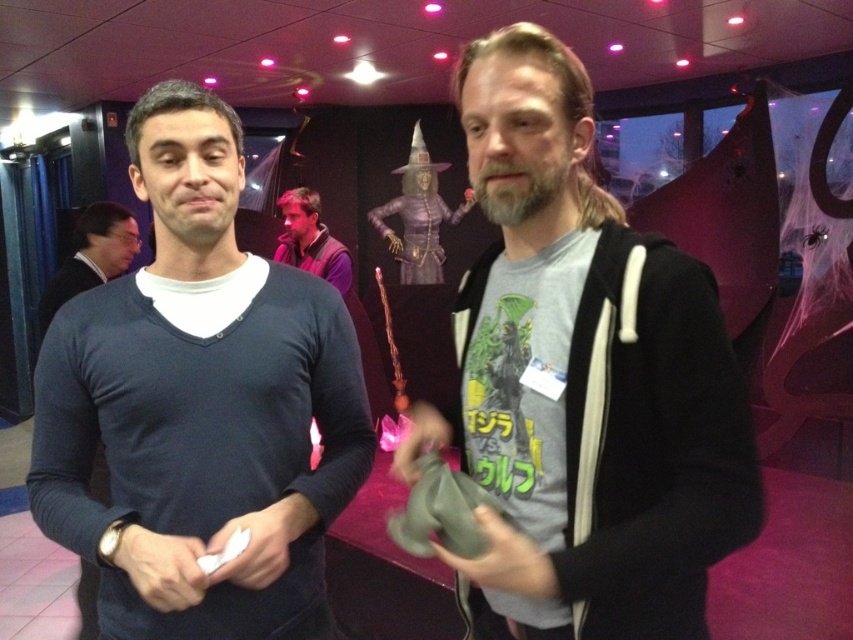
Is point (618, 435) positioned before point (294, 209)?

Yes.

Which is behind, point (689, 552) or point (308, 262)?

Positioned behind is point (308, 262).

The image size is (853, 640). Identify the location of gray matte t-shirt at center. (585, 378).

Can you confirm if dark blue sweater at left is wider than purple velvet shirt at center?

Yes.

Is dark blue sweater at left to the right of purple velvet shirt at center from the viewer's perspective?

Indeed, dark blue sweater at left is positioned on the right side of purple velvet shirt at center.

Does point (303, 472) lie in front of point (299, 193)?

Yes, point (303, 472) is closer to viewer.

The width and height of the screenshot is (853, 640). Identify the location of dark blue sweater at left. (199, 404).

How distant is dark blue sweater at left from matte black sweater at left?

A distance of 1.61 meters exists between dark blue sweater at left and matte black sweater at left.

In the scene shown: Between dark blue sweater at left and matte black sweater at left, which one appears on the right side from the viewer's perspective?

dark blue sweater at left is more to the right.

At what (x,y) coordinates should I click in order to perform the action: click on dark blue sweater at left. Please return your answer as a coordinate pair (x, y). Looking at the image, I should click on (199, 404).

Where is `dark blue sweater at left`? Image resolution: width=853 pixels, height=640 pixels. dark blue sweater at left is located at coordinates (199, 404).